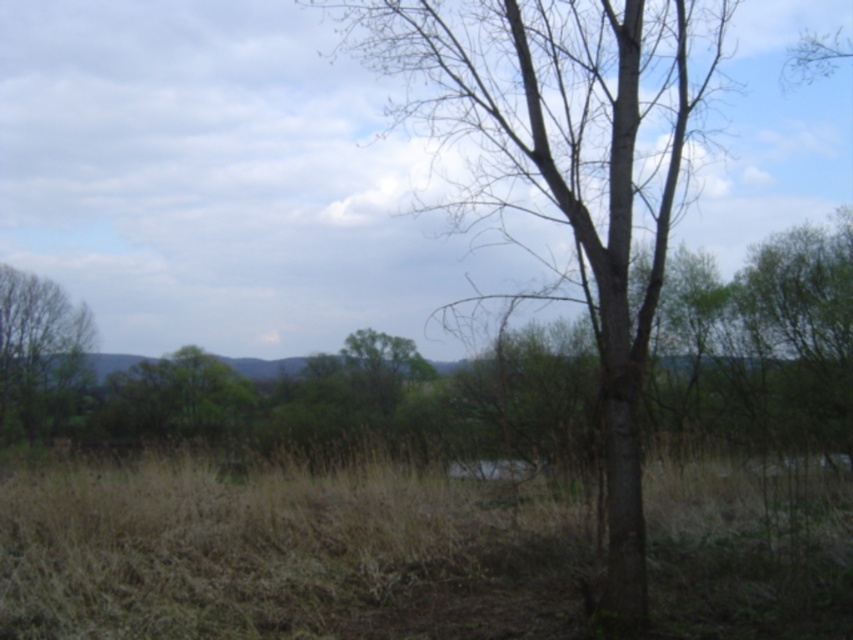
You are standing at the center of the image and want to place a small garden ornament exactly at the position of the brown dry grass at center. What are the coordinates where you should place it?

The coordinates for the brown dry grass at center are at point (286, 556), so you should place the garden ornament there.

You are a hiker trying to navigate through the brown dry grass at center and the green leafy tree at left. Which one would you choose to walk over if you want to avoid getting wet feet, assuming the ground is wet?

The brown dry grass at center is shorter than the green leafy tree at left, so walking over the brown dry grass at center would be better to avoid getting wet feet since it is lower and less likely to hold water.